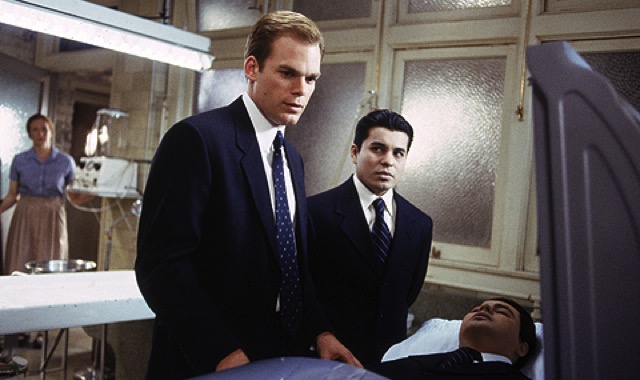
This screenshot has height=380, width=640. What are the coordinates of `preparation working table` in the screenshot? It's located at (80, 297).